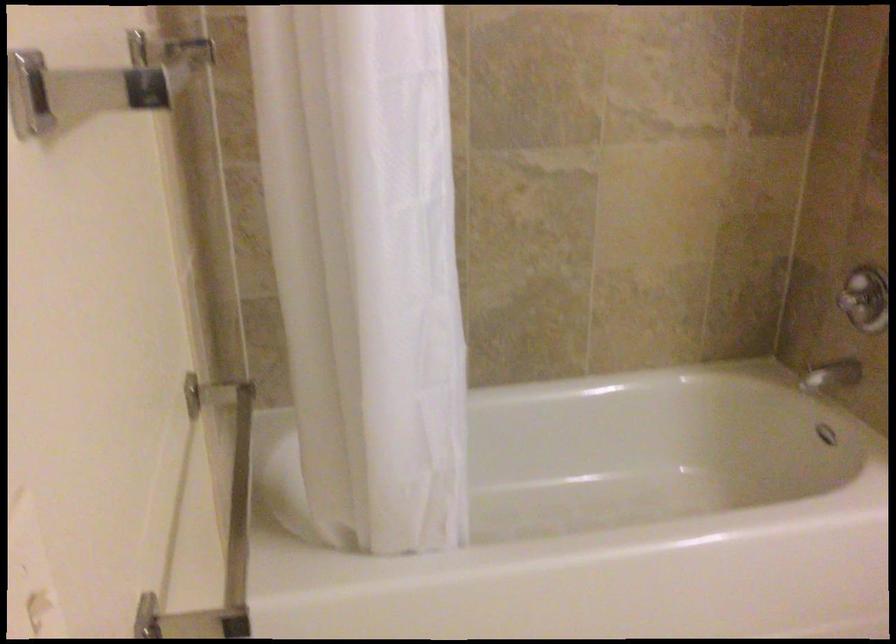
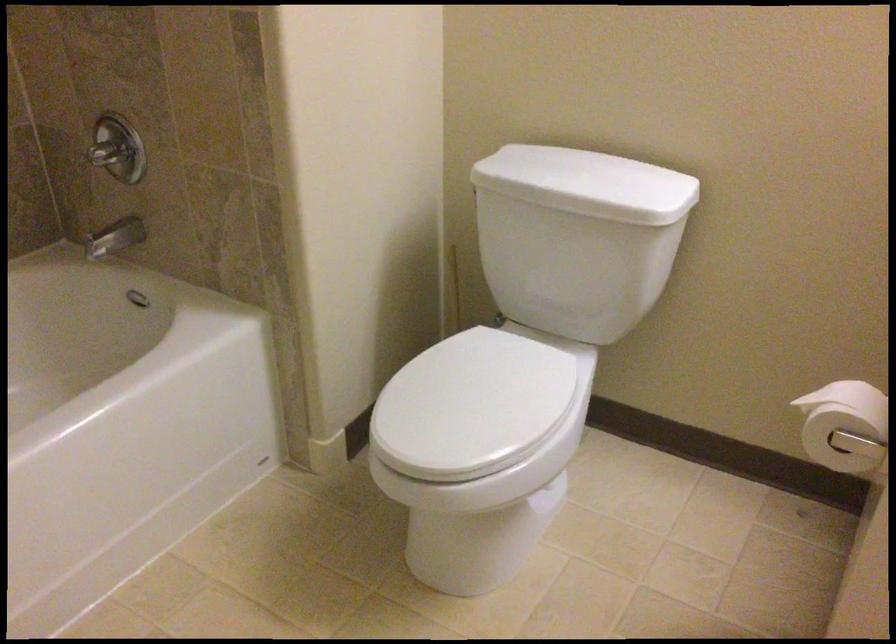
Question: The camera is either moving clockwise (left) or counter-clockwise (right) around the object. The first image is from the beginning of the video and the second image is from the end. Is the camera moving left or right when shooting the video?

Choices:
 (A) Left
 (B) Right

Answer: (A)